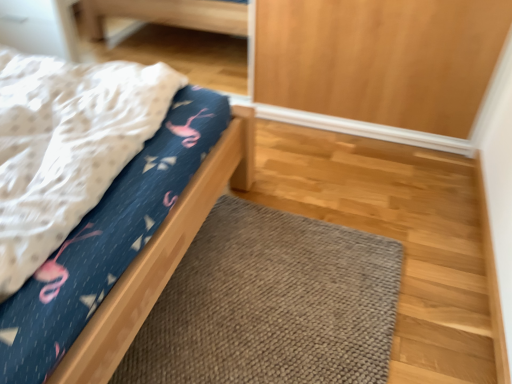
Question: Looking at the image, does matte blue fabric bed at left seem bigger or smaller compared to brown knitted doormat at lower center?

Choices:
 (A) small
 (B) big

Answer: (B)

Question: From the image's perspective, is matte blue fabric bed at left located above or below brown knitted doormat at lower center?

Choices:
 (A) below
 (B) above

Answer: (B)

Question: Relative to brown knitted doormat at lower center, is matte blue fabric bed at left in front or behind?

Choices:
 (A) behind
 (B) front

Answer: (B)

Question: From the image's perspective, is brown knitted doormat at lower center above or below matte blue fabric bed at left?

Choices:
 (A) below
 (B) above

Answer: (A)

Question: Is brown knitted doormat at lower center inside the boundaries of matte blue fabric bed at left, or outside?

Choices:
 (A) outside
 (B) inside

Answer: (A)

Question: From their relative heights in the image, would you say brown knitted doormat at lower center is taller or shorter than matte blue fabric bed at left?

Choices:
 (A) tall
 (B) short

Answer: (B)

Question: From a real-world perspective, is brown knitted doormat at lower center above or below matte blue fabric bed at left?

Choices:
 (A) above
 (B) below

Answer: (B)